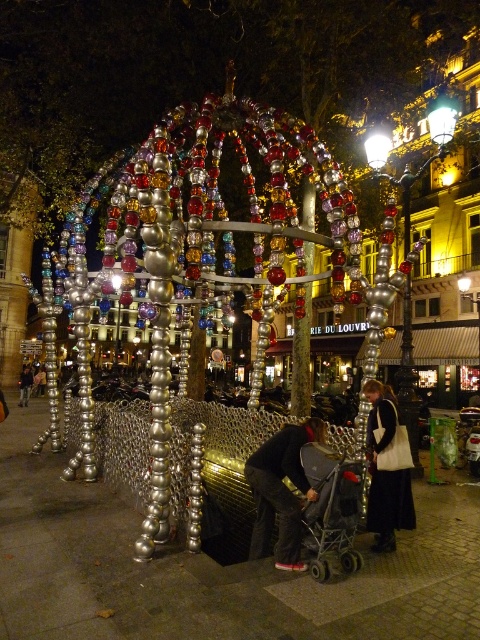
Question: Based on their relative distances, which object is farther from the black leather jacket at lower right?

Choices:
 (A) shiny metallic beads at center
 (B) metallic gray baby carriage at center
 (C) dark gray fabric stroller at center

Answer: (A)

Question: Which object is closer to the camera taking this photo?

Choices:
 (A) black leather jacket at lower right
 (B) metallic gray baby carriage at center
 (C) shiny metallic beads at center
 (D) dark gray fabric stroller at center

Answer: (D)

Question: Does shiny metallic beads at center have a lesser width compared to metallic gray baby carriage at center?

Choices:
 (A) yes
 (B) no

Answer: (B)

Question: Can you confirm if shiny metallic beads at center is positioned below dark gray fabric stroller at center?

Choices:
 (A) yes
 (B) no

Answer: (B)

Question: Which of the following is the closest to the observer?

Choices:
 (A) black leather jacket at lower right
 (B) dark gray fabric stroller at center

Answer: (B)

Question: Does dark gray fabric stroller at center appear on the left side of metallic gray baby carriage at center?

Choices:
 (A) yes
 (B) no

Answer: (A)